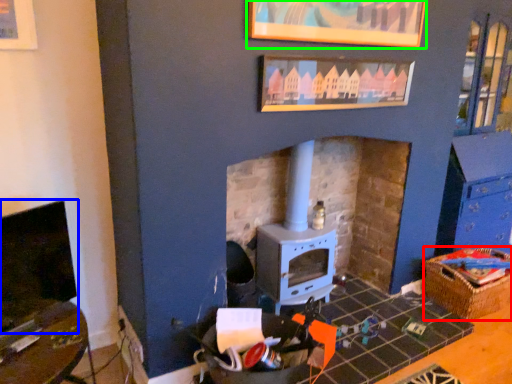
Question: Considering the real-world distances, which object is farthest from crate (highlighted by a red box)? fireplace (highlighted by a blue box) or picture frame (highlighted by a green box)?

Choices:
 (A) fireplace
 (B) picture frame

Answer: (A)